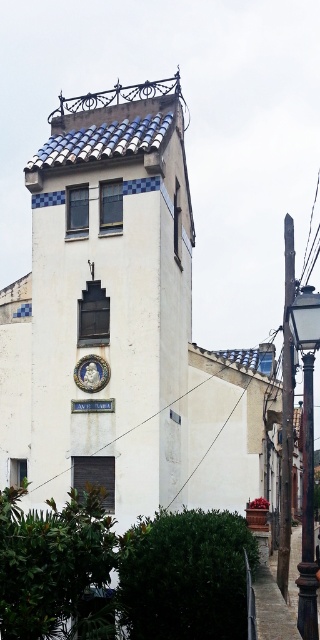
Which is in front, point (18, 552) or point (266, 580)?

Positioned in front is point (18, 552).

In order to click on green leafy hedge at lower left in this screenshot , I will do `click(55, 566)`.

From the picture: Is metallic gray pole at right smaller than dark brown wooden post at lower right?

Actually, metallic gray pole at right might be larger than dark brown wooden post at lower right.

Where is `metallic gray pole at right`? This screenshot has height=640, width=320. metallic gray pole at right is located at coordinates [287, 412].

Find the location of `metallic gray pole at right`. metallic gray pole at right is located at coordinates (287, 412).

From the picture: Is green leafy hedge at lower center wider than black wrought iron pole at right?

Correct, the width of green leafy hedge at lower center exceeds that of black wrought iron pole at right.

Who is taller, green leafy hedge at lower center or black wrought iron pole at right?

black wrought iron pole at right

Is point (221, 600) positioned after point (310, 412)?

No.

You are a GUI agent. You are given a task and a screenshot of the screen. Output one action in this format:
    pyautogui.click(x=<x>, y=<y>)
    Task: Click on the green leafy hedge at lower center
    This screenshot has height=640, width=320.
    Given the screenshot: What is the action you would take?
    pyautogui.click(x=185, y=576)